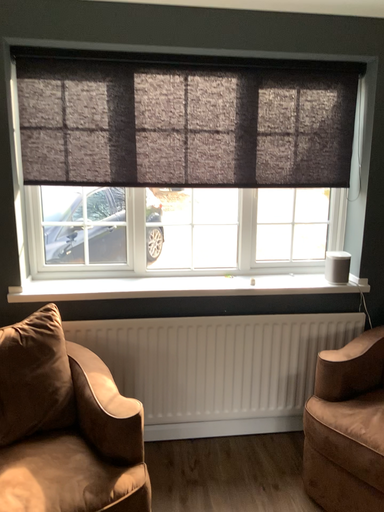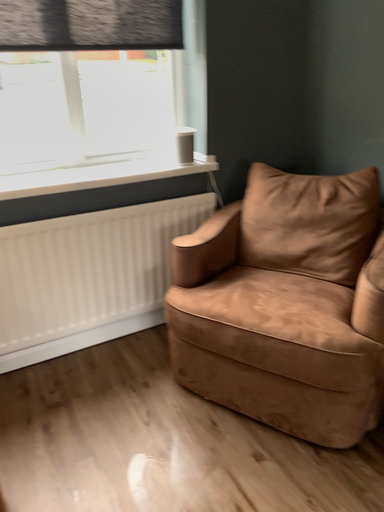
Question: How did the camera likely rotate when shooting the video?

Choices:
 (A) rotated downward
 (B) rotated upward

Answer: (A)